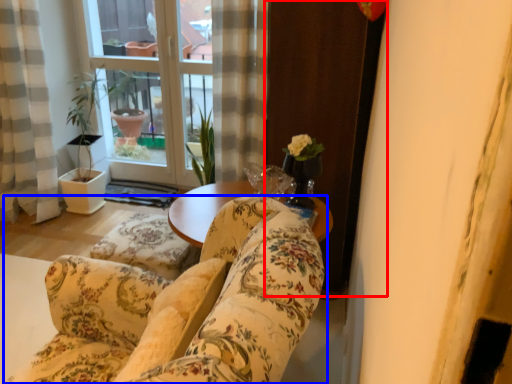
Question: Which of the following is the closest to the observer, screen door (highlighted by a red box) or studio couch (highlighted by a blue box)?

Choices:
 (A) screen door
 (B) studio couch

Answer: (B)